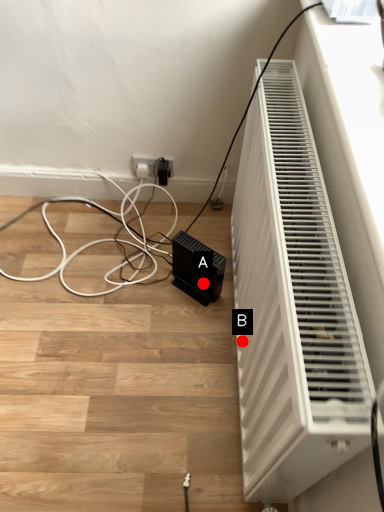
Question: Two points are circled on the image, labeled by A and B beside each circle. Among these points, which one is farthest from the camera?

Choices:
 (A) A is further
 (B) B is further

Answer: (A)